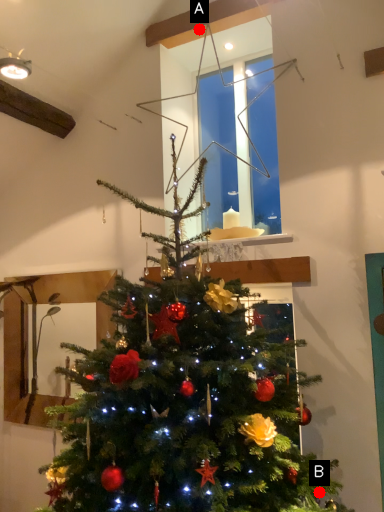
Question: Two points are circled on the image, labeled by A and B beside each circle. Which point is closer to the camera taking this photo?

Choices:
 (A) A is closer
 (B) B is closer

Answer: (B)